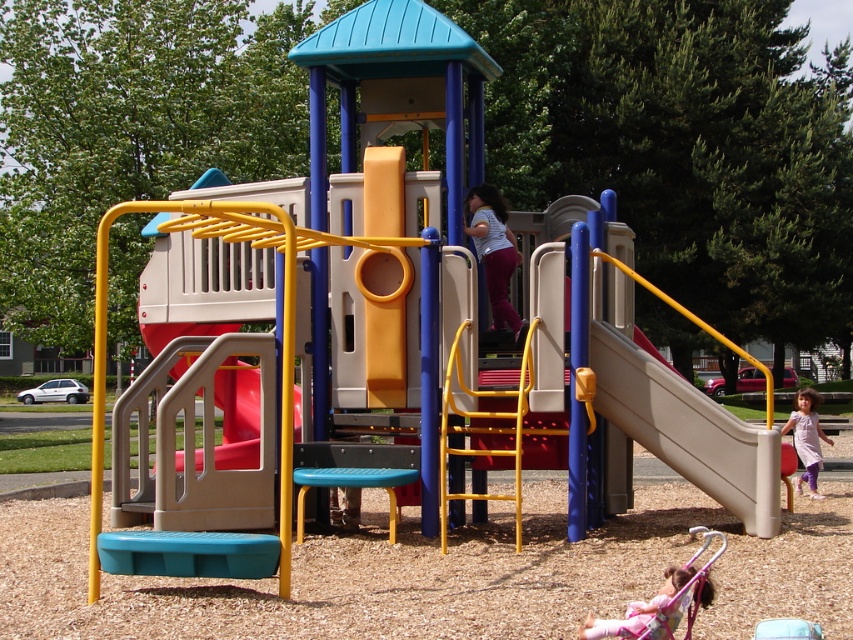
Question: Estimate the real-world distances between objects in this image. Which object is closer to the matte purple pants at center?

Choices:
 (A) pastel pink fabric at lower right
 (B) light purple fabric dress at lower right
 (C) beige plastic slide at right

Answer: (C)

Question: Estimate the real-world distances between objects in this image. Which object is farther from the light purple fabric dress at lower right?

Choices:
 (A) pastel pink fabric at lower right
 (B) beige plastic slide at right
 (C) matte purple pants at center

Answer: (A)

Question: Which of the following is the closest to the observer?

Choices:
 (A) (677, 467)
 (B) (694, 570)

Answer: (B)

Question: Is beige plastic slide at right below pastel pink fabric at lower right?

Choices:
 (A) no
 (B) yes

Answer: (A)

Question: Can you confirm if matte purple pants at center is wider than pastel pink fabric at lower right?

Choices:
 (A) yes
 (B) no

Answer: (B)

Question: Does beige plastic slide at right have a lesser width compared to matte purple pants at center?

Choices:
 (A) no
 (B) yes

Answer: (A)